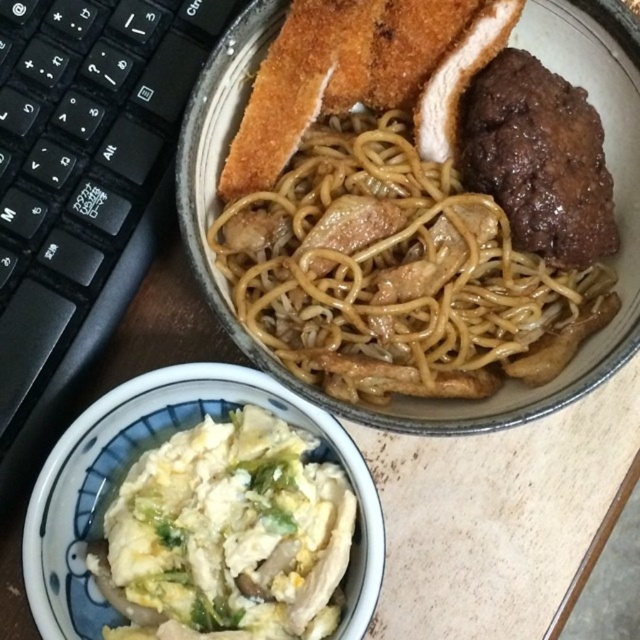
Is black plastic keyboard at upper left thinner than brown glossy meat at center?

Incorrect, black plastic keyboard at upper left's width is not less than brown glossy meat at center's.

The width and height of the screenshot is (640, 640). Identify the location of black plastic keyboard at upper left. (81, 186).

Is point (611, 300) behind point (16, 422)?

No, (611, 300) is closer to viewer.

Who is higher up, brown glossy noodles at center or black plastic keyboard at upper left?

black plastic keyboard at upper left is higher up.

Is point (342, 376) positioned behind point (68, 241)?

That is False.

The image size is (640, 640). I want to click on brown glossy noodles at center, so [x=396, y=273].

In the scene shown: Is black plastic keyboard at upper left wider than white fluffy scrambled eggs at lower left?

Incorrect, black plastic keyboard at upper left's width does not surpass white fluffy scrambled eggs at lower left's.

This screenshot has height=640, width=640. I want to click on black plastic keyboard at upper left, so click(81, 186).